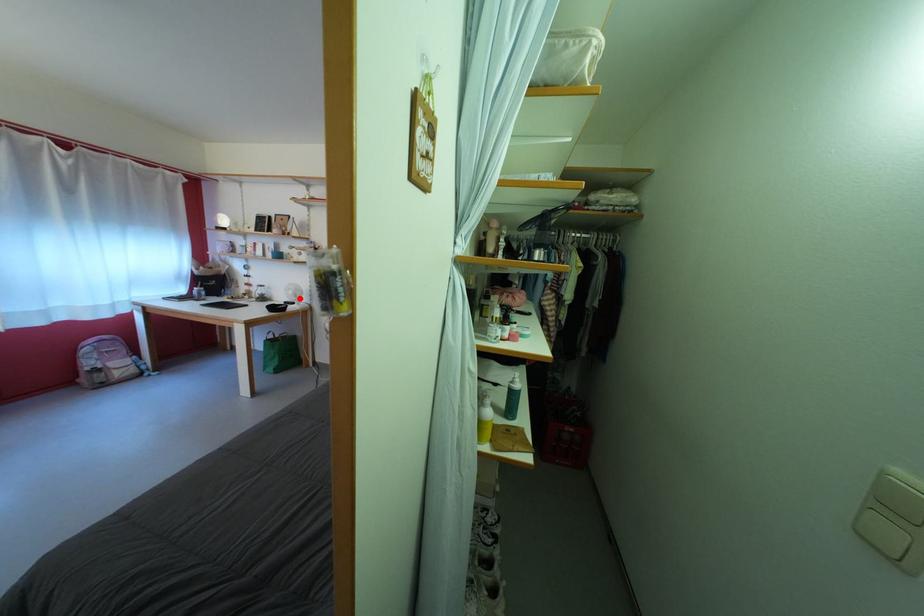
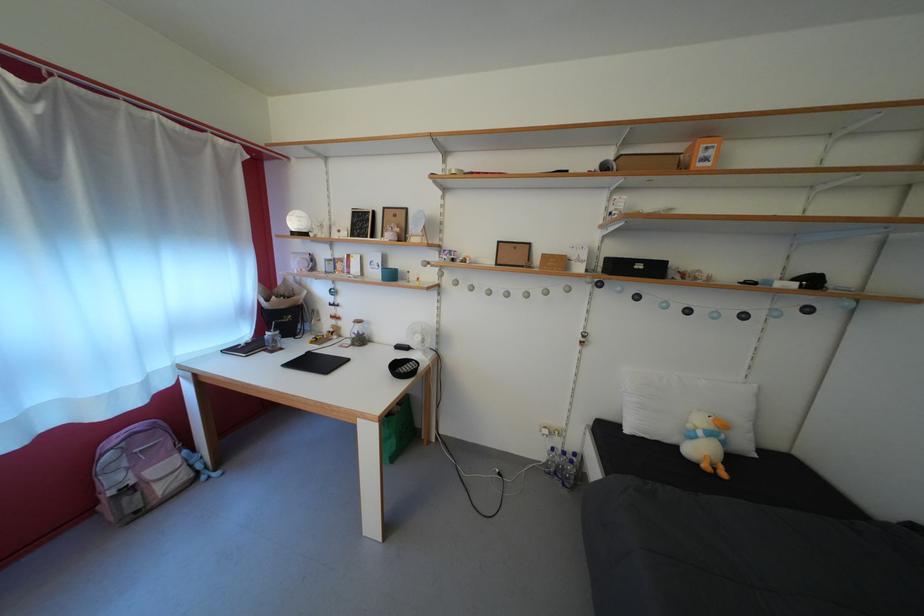
Locate, in the second image, the point that corresponds to the highlighted location in the first image.

(427, 344)